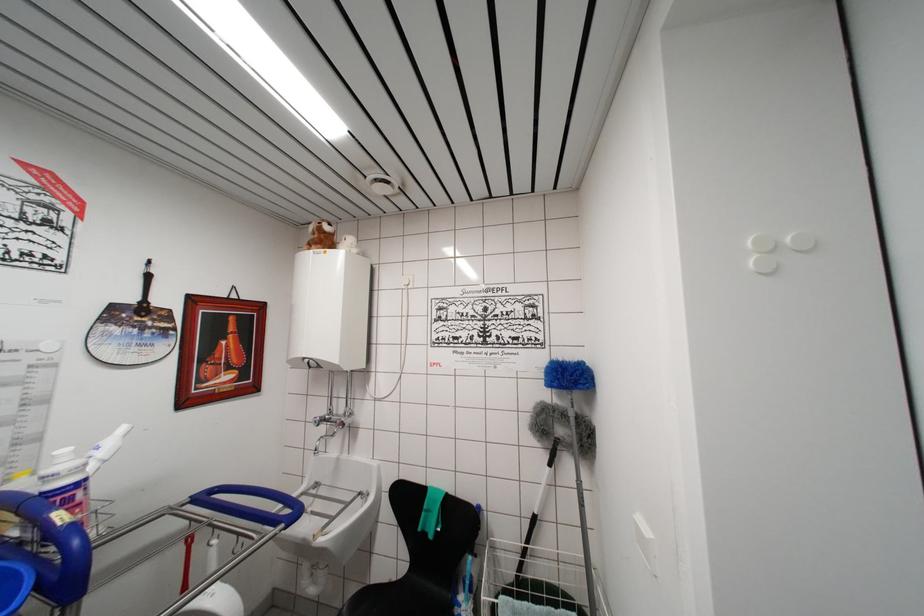
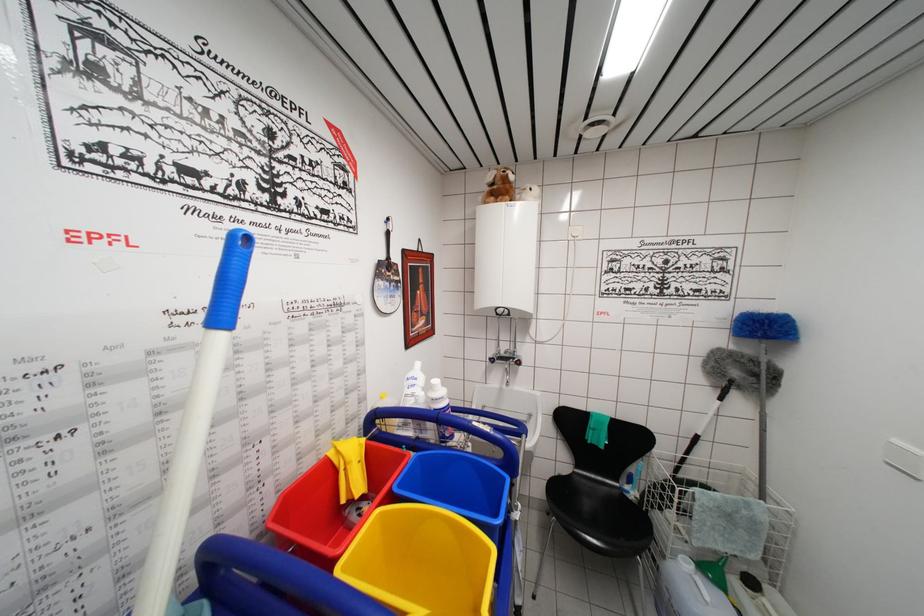
Question: How did the camera likely rotate?

Choices:
 (A) Left
 (B) Right
 (C) Up
 (D) Down

Answer: (D)